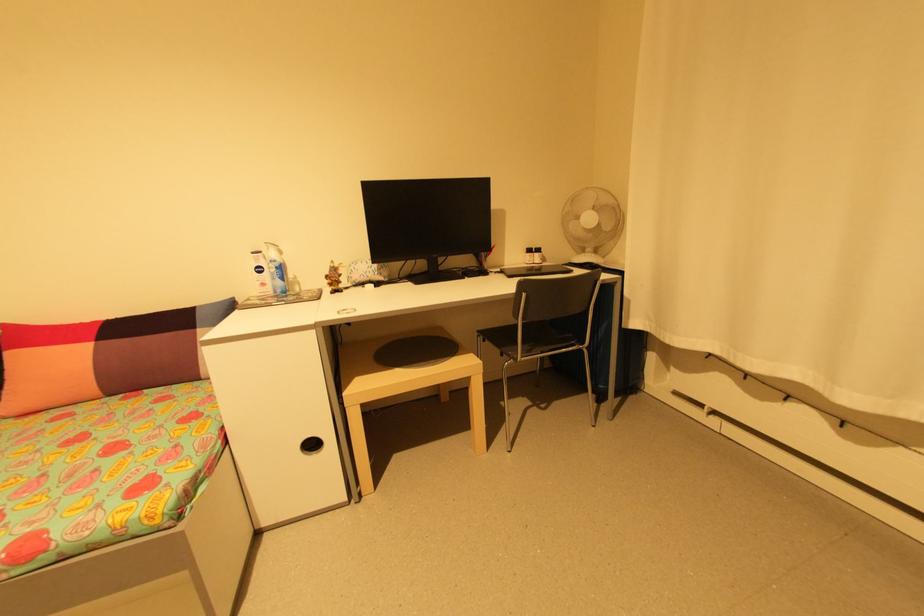
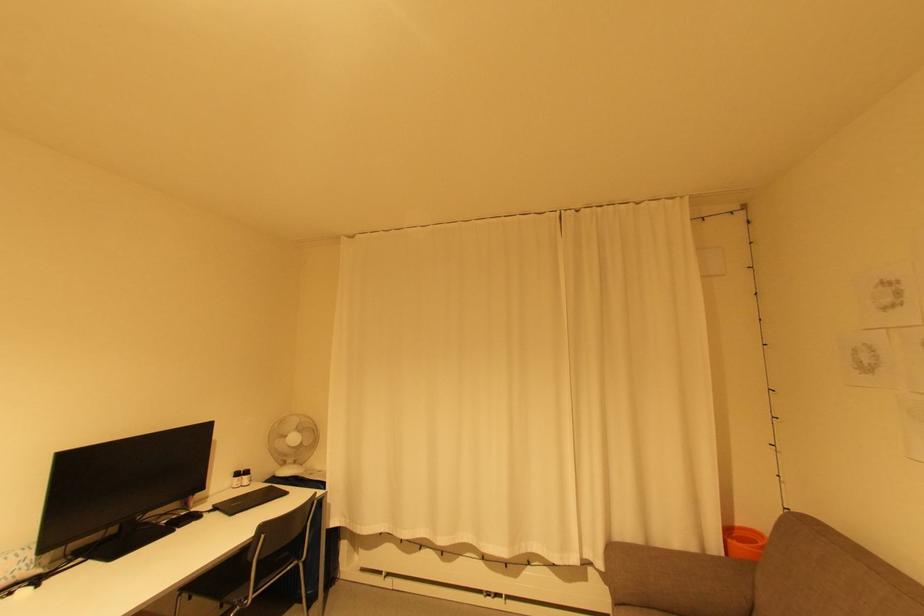
Where in the second image is the point corresponding to (529,252) from the first image?

(237, 476)